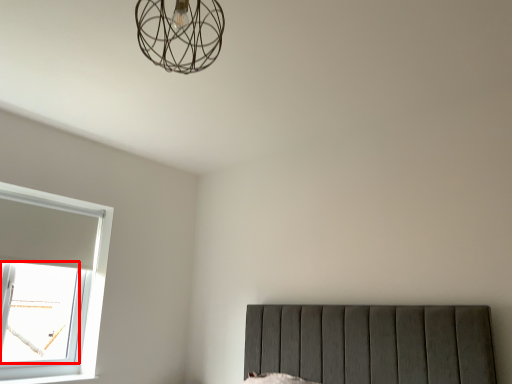
Question: From the image's perspective, what is the correct spatial relationship of window screen (annotated by the red box) in relation to lamp?

Choices:
 (A) below
 (B) above

Answer: (A)